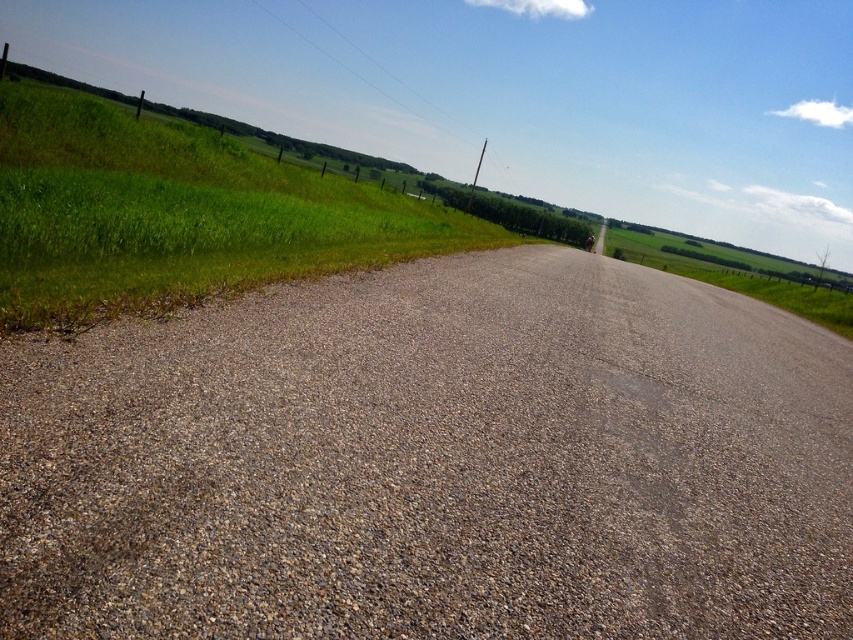
You are standing at the starting point of the rural road and want to reach a destination located at point (28, 179). There is another point at (260, 374) along the way. Based on their positions, which point should you pass first?

You should pass point (260, 374) first because it is in front of point (28, 179) along the path.

You are a gardener who wants to plant flowers in the gray gravel at center and green grass at left. Which area would you choose for better growth, considering the size of the plants?

The green grass at left would be better for planting flowers since it has a larger size compared to the gray gravel at center, providing more space and nutrients for plant growth.